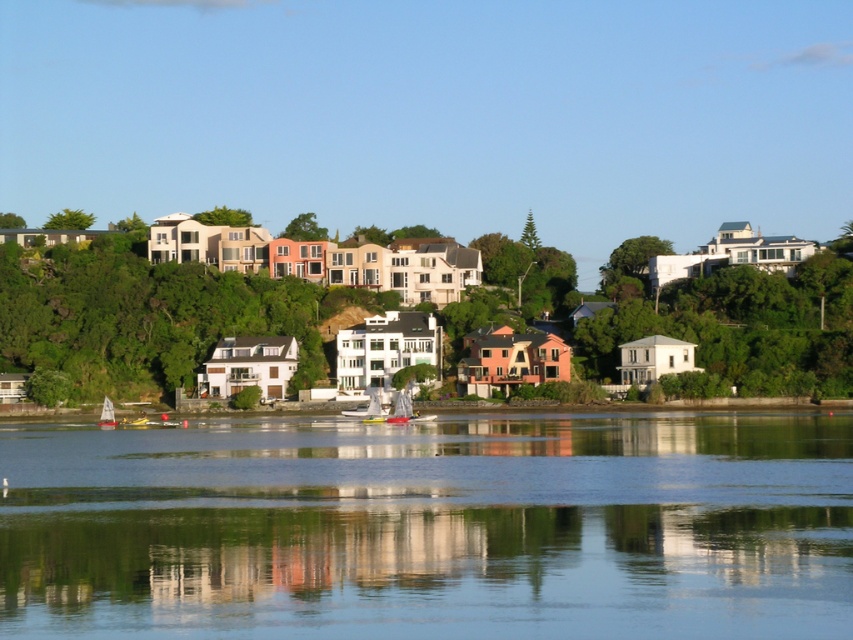
You are a photographer planning to capture the reflection of the houses in the clear water at center. However, you notice the yellow matte sailboat at lower left might block the view. Based on their sizes, will the sailboat obscure the reflection of the houses in the water?

The clear water at center is shorter than the yellow matte sailboat at lower left, meaning the sailboat is taller. Since the sailboat is taller, it could potentially block the reflection of the houses in the water.

You are planning to build a dock connecting the clear water at center to the smooth concrete shoreline at lower center. Given that the distance between them is 48.00 meters, what is the minimum length your dock must be to span this distance?

The dock must be at least 48.00 meters long to span the distance between the clear water at center and the smooth concrete shoreline at lower center.

You are a photographer planning to capture the smooth concrete shoreline at lower center and the yellow matte sailboat at lower left in a single frame. Based on their sizes, which object should appear bigger in your photo?

The smooth concrete shoreline at lower center should appear bigger in the photo because it has a larger size compared to the yellow matte sailboat at lower left.